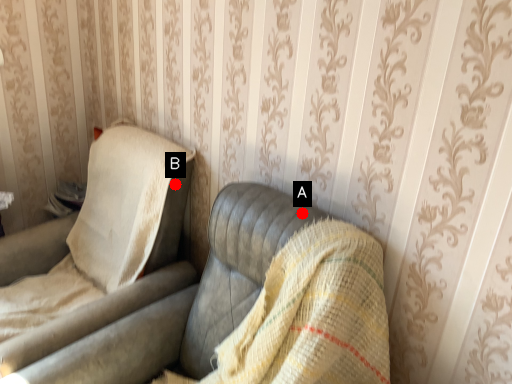
Question: Two points are circled on the image, labeled by A and B beside each circle. Which point is farther to the camera?

Choices:
 (A) A is further
 (B) B is further

Answer: (B)